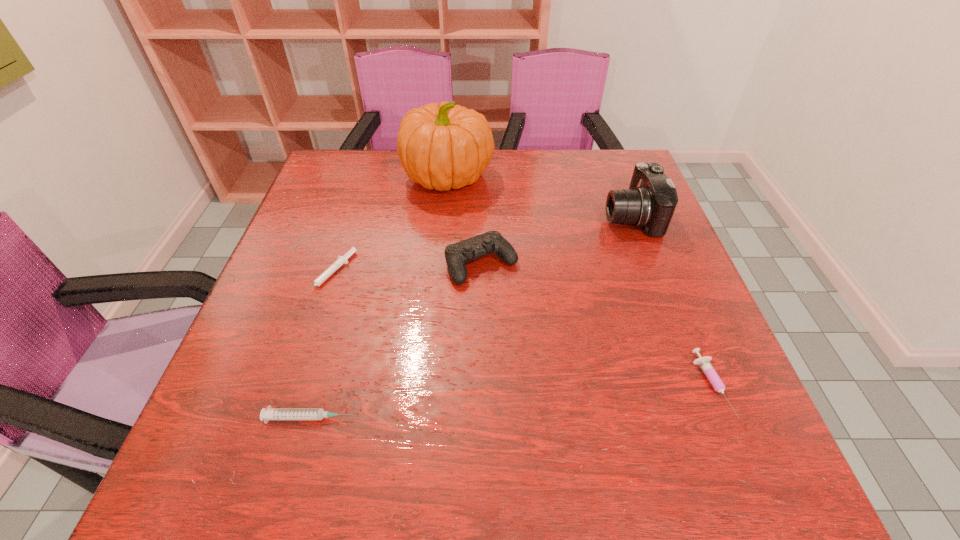
This screenshot has height=540, width=960. In order to click on vacant space positioned on the right of the control in this screenshot , I will do `click(596, 264)`.

You are a GUI agent. You are given a task and a screenshot of the screen. Output one action in this format:
    pyautogui.click(x=<x>, y=<y>)
    Task: Click on the free space located on the left of the rightmost syringe
    The image size is (960, 540).
    Given the screenshot: What is the action you would take?
    pyautogui.click(x=655, y=386)

In order to click on free spot located 0.300m on the right of the shortest object in this screenshot , I will do `click(485, 275)`.

Where is `pumpkin situated at the far edge`? pumpkin situated at the far edge is located at coordinates (441, 146).

The image size is (960, 540). I want to click on camera that is at the far edge, so click(650, 202).

The image size is (960, 540). Identify the location of camera present at the right edge. (650, 202).

The height and width of the screenshot is (540, 960). Find the location of `syringe located in the right edge section of the desktop`. syringe located in the right edge section of the desktop is located at coordinates (704, 362).

You are a GUI agent. You are given a task and a screenshot of the screen. Output one action in this format:
    pyautogui.click(x=<x>, y=<y>)
    Task: Click on the object present at the far right corner
    This screenshot has height=540, width=960.
    Given the screenshot: What is the action you would take?
    pyautogui.click(x=650, y=202)

In the image, there is a desktop. Where is `vacant space at the far edge`? vacant space at the far edge is located at coordinates (396, 154).

The height and width of the screenshot is (540, 960). What are the coordinates of `blank space at the near edge of the desktop` in the screenshot? It's located at (475, 453).